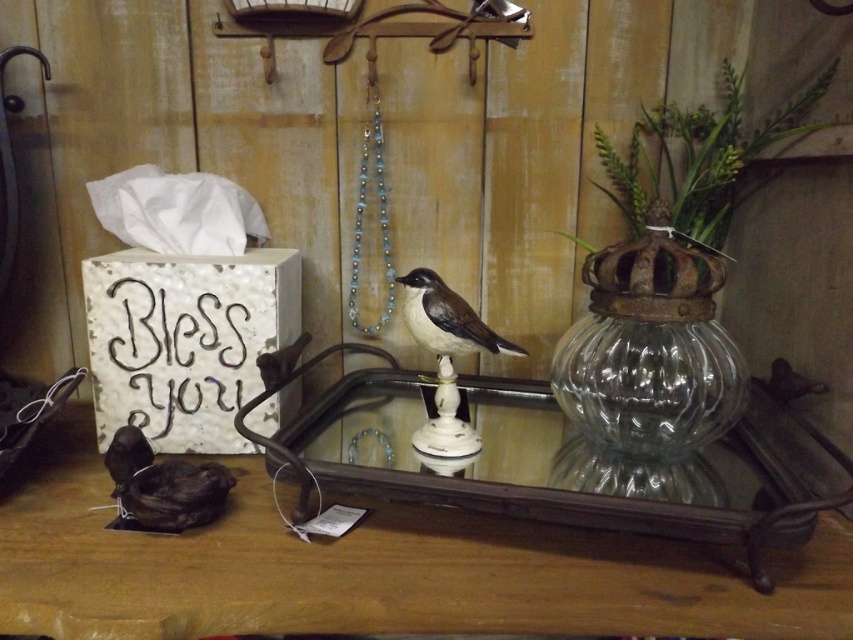
You are standing in front of the decorative arrangement. The brown wooden table at lower center is represented by point (376, 568). Which object is closer to this point? The white tissue box with the words

The white tissue box with the words

You are looking at the decorative arrangement on the wooden surface. There are two points marked in the image. Which point is closer to you, point (97,534) or point (491,337)?

Point (97,534) is closer to you than point (491,337).

You are a delivery person who needs to place a small package on the wooden surface without blocking the mirror. The package will be placed at the point marked by coordinates point [650,349]. Will the package be placed on the mirror?

The point [650,349] is on the clear glass vase at center, so placing the package there would not block the mirror since it is on the vase, not the mirror.